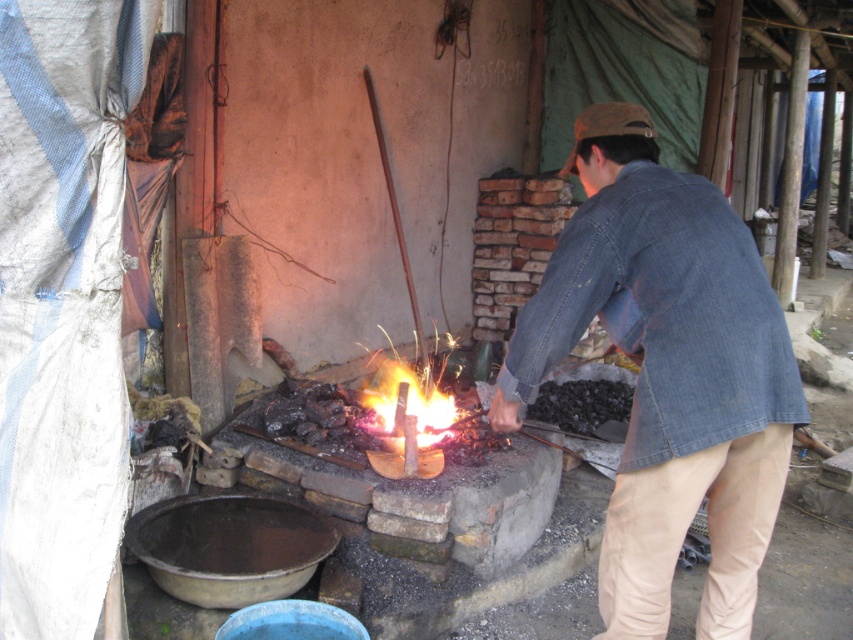
Is denim jacket at center to the right of flaming hot steel at center from the viewer's perspective?

Yes, denim jacket at center is to the right of flaming hot steel at center.

Between denim jacket at center and flaming hot steel at center, which one has less height?

With less height is flaming hot steel at center.

Is point (573, 280) closer to viewer compared to point (376, 387)?

Yes, point (573, 280) is closer to viewer.

Locate an element on the screen. denim jacket at center is located at coordinates (666, 372).